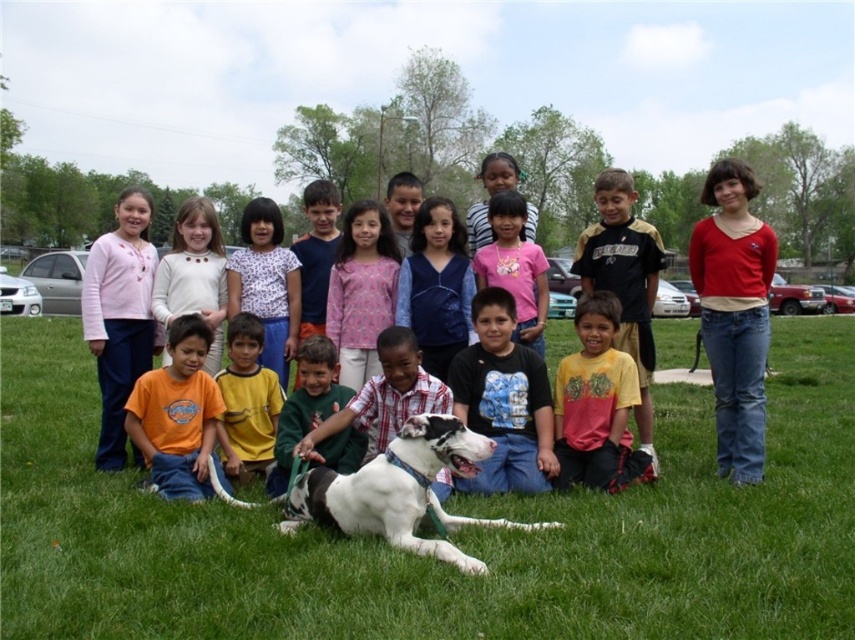
Which is behind, point (416, 348) or point (535, 342)?

The point (535, 342) is more distant.

Which of these two, white glossy dog at center or pink cotton shirt at center, stands shorter?

white glossy dog at center is shorter.

Does point (361, 417) lie in front of point (516, 205)?

Yes, it is in front of point (516, 205).

Locate an element on the screen. Image resolution: width=855 pixels, height=640 pixels. white glossy dog at center is located at coordinates (385, 396).

Can you confirm if matte green shirt at center is thinner than black jersey at center?

In fact, matte green shirt at center might be wider than black jersey at center.

Does point (629, 289) come behind point (647, 276)?

No, it is in front of (647, 276).

The height and width of the screenshot is (640, 855). Find the location of `matte green shirt at center`. matte green shirt at center is located at coordinates (581, 278).

Can you confirm if yellow shirt at center is wider than pink cotton shirt at center?

In fact, yellow shirt at center might be narrower than pink cotton shirt at center.

Between yellow shirt at center and pink cotton shirt at center, which one appears on the right side from the viewer's perspective?

pink cotton shirt at center

Is point (225, 435) behind point (514, 193)?

No.

Where is `yellow shirt at center`? The image size is (855, 640). yellow shirt at center is located at coordinates (246, 401).